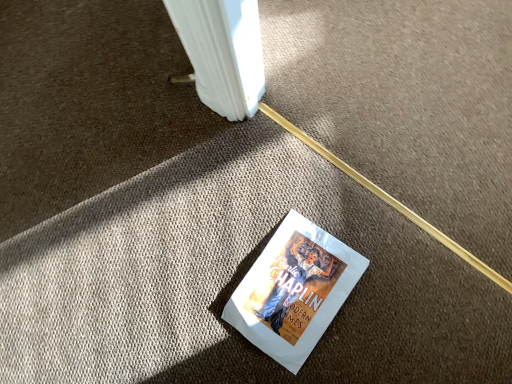
What do you see at coordinates (294, 290) in the screenshot?
I see `white paper at center` at bounding box center [294, 290].

This screenshot has height=384, width=512. I want to click on white paper at center, so click(x=294, y=290).

Find the location of `white paper at center`. white paper at center is located at coordinates (294, 290).